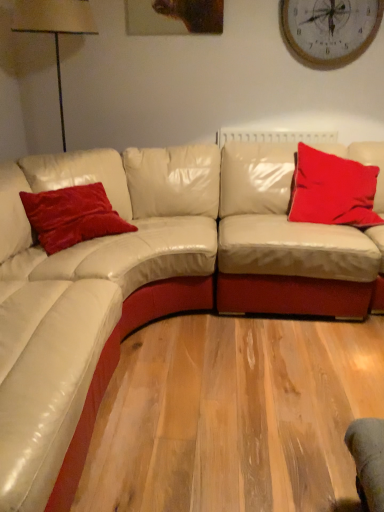
Question: Can you see wooden clock at upper center touching velvet red pillow at upper right, which is the second pillow in left-to-right order?

Choices:
 (A) yes
 (B) no

Answer: (B)

Question: Does wooden clock at upper center lie behind velvet red pillow at upper right, marked as the 1th pillow in a right-to-left arrangement?

Choices:
 (A) no
 (B) yes

Answer: (B)

Question: Is wooden clock at upper center surrounding velvet red pillow at upper right, which is the second pillow in left-to-right order?

Choices:
 (A) yes
 (B) no

Answer: (B)

Question: Is wooden clock at upper center at the left side of velvet red pillow at upper right, marked as the 1th pillow in a right-to-left arrangement?

Choices:
 (A) yes
 (B) no

Answer: (B)

Question: Is wooden clock at upper center positioned before velvet red pillow at upper right, which is the second pillow in left-to-right order?

Choices:
 (A) no
 (B) yes

Answer: (A)

Question: Considering the positions of wooden clock at upper center and velvet red pillow at upper right, which is the second pillow in left-to-right order, in the image, is wooden clock at upper center wider or thinner than velvet red pillow at upper right, which is the second pillow in left-to-right order,?

Choices:
 (A) thin
 (B) wide

Answer: (A)

Question: Based on their positions, is wooden clock at upper center located to the left or right of velvet red pillow at upper right, which is the second pillow in left-to-right order?

Choices:
 (A) left
 (B) right

Answer: (B)

Question: Relative to velvet red pillow at upper right, which is the second pillow in left-to-right order, is wooden clock at upper center in front or behind?

Choices:
 (A) behind
 (B) front

Answer: (A)

Question: Is wooden clock at upper center bigger or smaller than velvet red pillow at upper right, marked as the 1th pillow in a right-to-left arrangement?

Choices:
 (A) small
 (B) big

Answer: (A)

Question: From the image's perspective, is velvet red pillow at upper right, which is the second pillow in left-to-right order, positioned above or below beige fabric lampshade at left?

Choices:
 (A) below
 (B) above

Answer: (A)

Question: In the image, is velvet red pillow at upper right, which is the second pillow in left-to-right order, on the left side or the right side of beige fabric lampshade at left?

Choices:
 (A) right
 (B) left

Answer: (A)

Question: Is velvet red pillow at upper right, which is the second pillow in left-to-right order, in front of or behind beige fabric lampshade at left in the image?

Choices:
 (A) behind
 (B) front

Answer: (B)

Question: Is point (336, 195) closer or farther from the camera than point (21, 1)?

Choices:
 (A) closer
 (B) farther

Answer: (B)

Question: From the image's perspective, is beige fabric lampshade at left located above or below wooden clock at upper center?

Choices:
 (A) below
 (B) above

Answer: (A)

Question: Is beige fabric lampshade at left spatially inside wooden clock at upper center, or outside of it?

Choices:
 (A) outside
 (B) inside

Answer: (A)